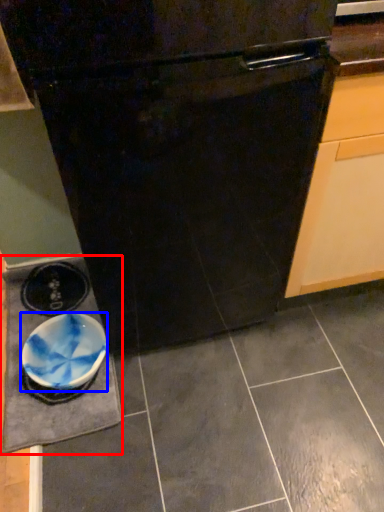
Question: Which point is further to the camera, slate (highlighted by a red box) or bowl (highlighted by a blue box)?

Choices:
 (A) slate
 (B) bowl

Answer: (B)